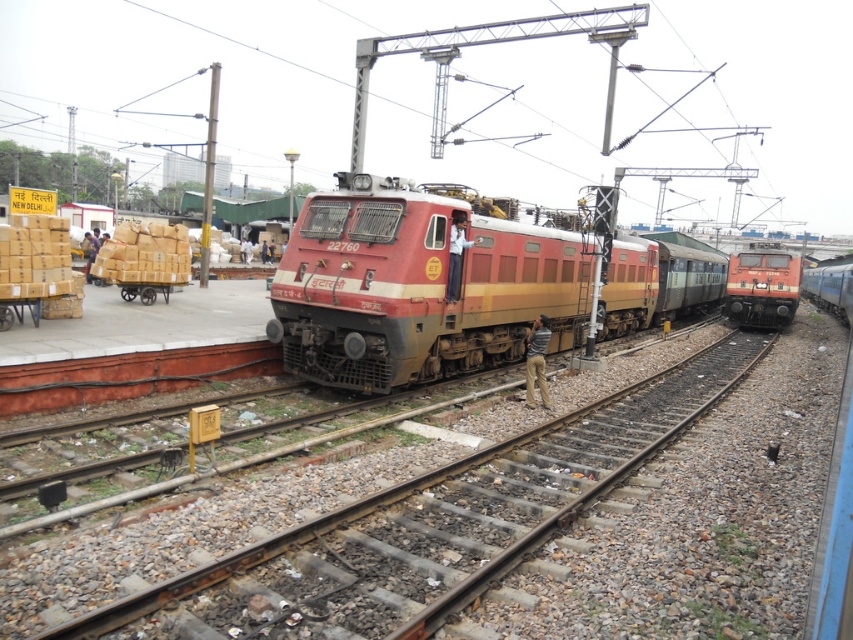
Consider the image. Does blue metallic train at right appear over wooden cart at left?

Indeed, blue metallic train at right is positioned over wooden cart at left.

Who is higher up, blue metallic train at right or wooden cart at left?

blue metallic train at right

In order to click on blue metallic train at right in this screenshot , I will do `click(830, 288)`.

Where is `blue metallic train at right`? blue metallic train at right is located at coordinates (830, 288).

Which is below, rusty metal train track at center or matte orange train at right?

rusty metal train track at center is lower down.

Can you confirm if rusty metal train track at center is positioned to the left of matte orange train at right?

Indeed, rusty metal train track at center is positioned on the left side of matte orange train at right.

Which is in front, point (340, 628) or point (787, 275)?

Point (340, 628) is more forward.

Locate an element on the screen. The height and width of the screenshot is (640, 853). rusty metal train track at center is located at coordinates (448, 516).

Can you confirm if matte orange train at right is positioned above blue metallic train at right?

No.

Who is higher up, matte orange train at right or blue metallic train at right?

blue metallic train at right is higher up.

Identify the location of matte orange train at right. (762, 285).